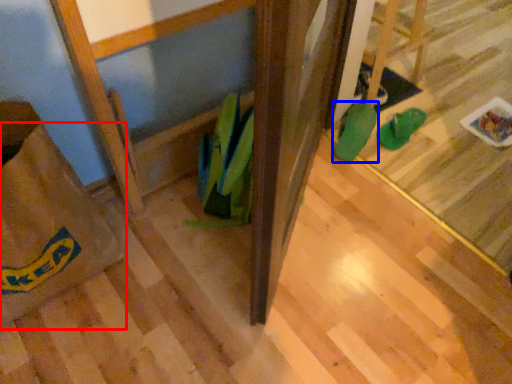
Question: Among these objects, which one is farthest to the camera, grocery bag (highlighted by a red box) or footwear (highlighted by a blue box)?

Choices:
 (A) grocery bag
 (B) footwear

Answer: (B)